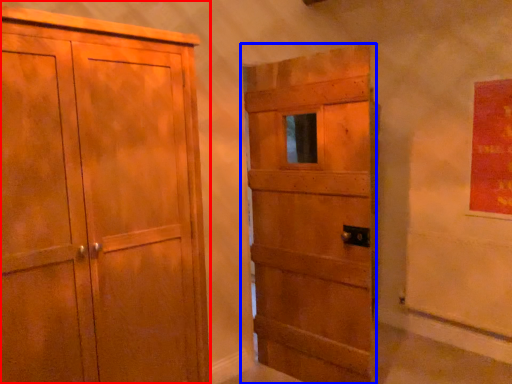
Question: Which point is closer to the camera, cupboard (highlighted by a red box) or door (highlighted by a blue box)?

Choices:
 (A) cupboard
 (B) door

Answer: (A)